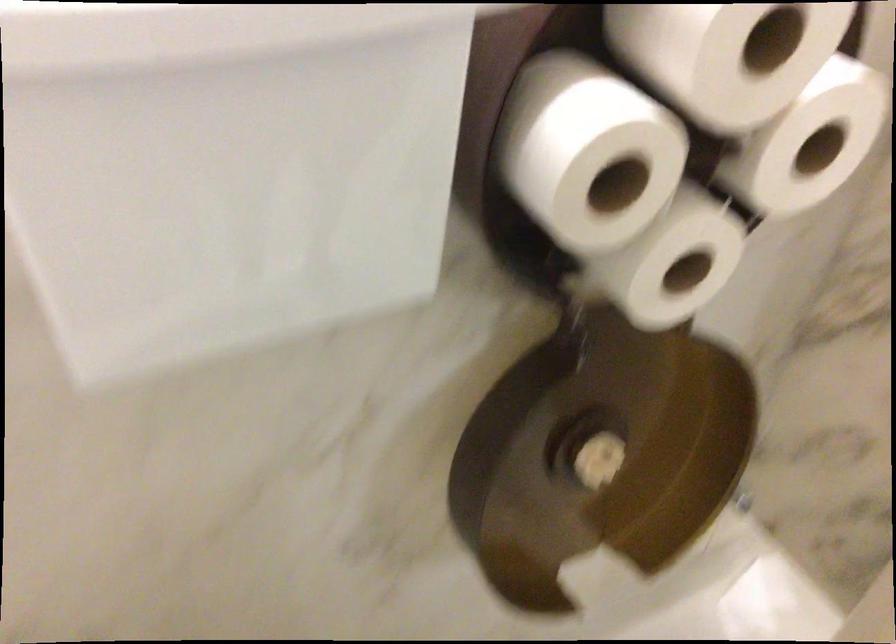
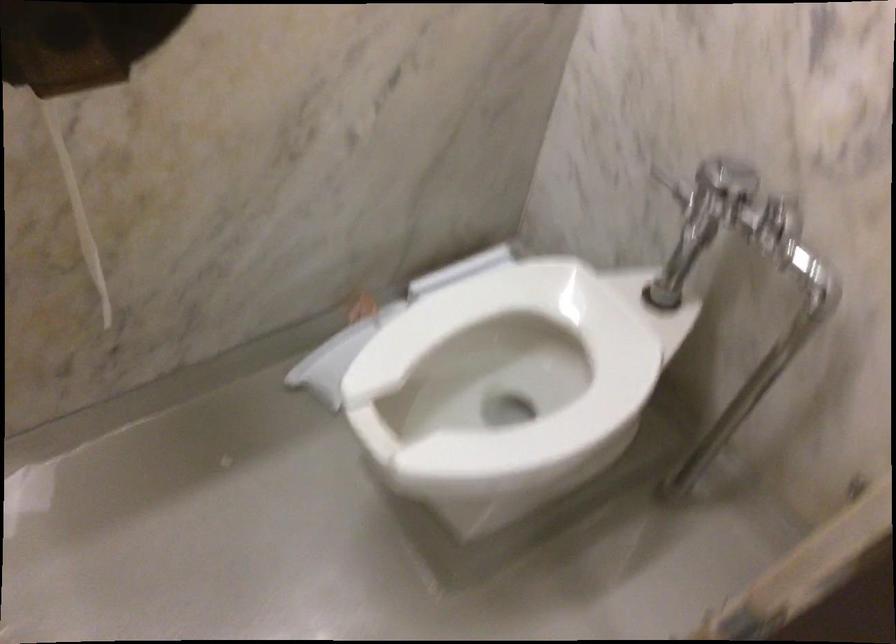
Question: Which direction would the cameraman need to move to produce the second image? Reply with the corresponding letter.

Choices:
 (A) Left
 (B) Right
 (C) Forward
 (D) Backward

Answer: (B)